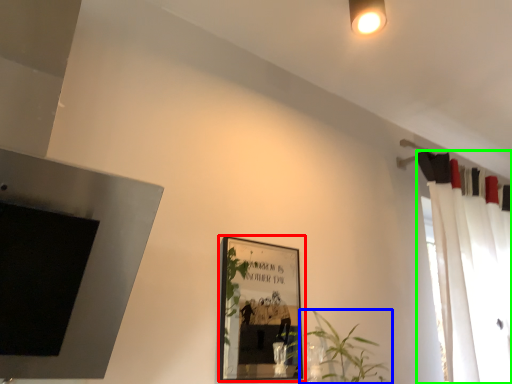
Question: Based on their relative distances, which object is nearer to picture frame (highlighted by a red box)? Choose from houseplant (highlighted by a blue box) and curtain (highlighted by a green box).

Choices:
 (A) houseplant
 (B) curtain

Answer: (B)